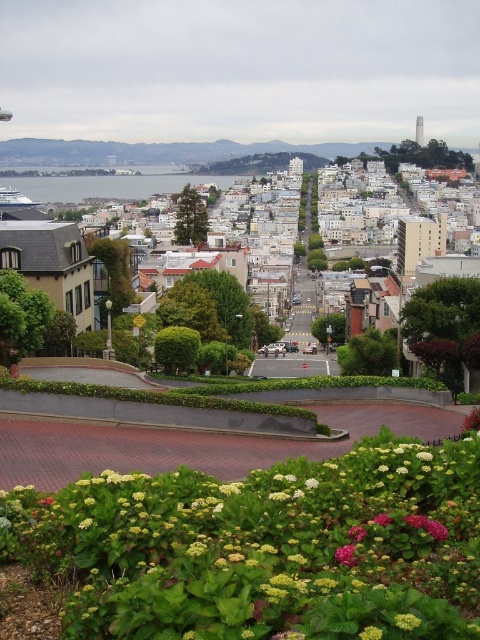
You are standing at the top of Lombard Street and want to place a small decorative flag at the point with coordinates point (263,547). According to the image, where exactly should you place the flag?

The point (263,547) is on the green leafy bush at lower center, so you should place the flag on the green leafy bush at lower center located at the lower center of the image.

You are a delivery drone with a maximum flight range of 500 feet. You need to deliver a package from the brown wooden houses at center to the purple matte flower at center. Can you complete the delivery without needing to recharge?

The distance between the brown wooden houses at center and the purple matte flower at center is 520.40 feet, which exceeds the drone flight range of 500 feet. Therefore, the drone cannot complete the delivery without recharging.

You are a city planner assessing the view of Lombard Street. You notice the brown wooden houses at center and the purple matte flower at center in the scene. Which object appears taller from your vantage point?

The brown wooden houses at center appears taller than the purple matte flower at center because the brown wooden houses at center has a greater height compared to purple matte flower at center.